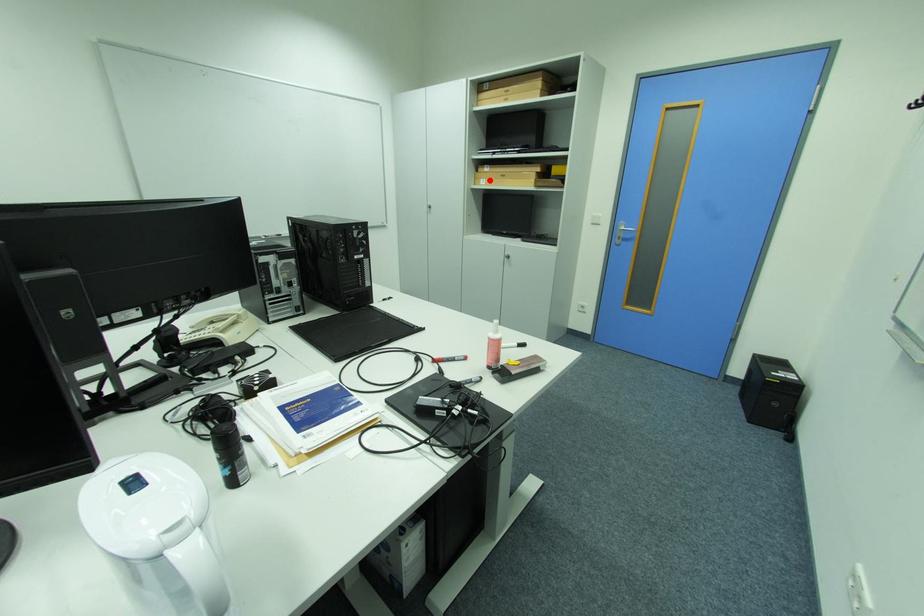
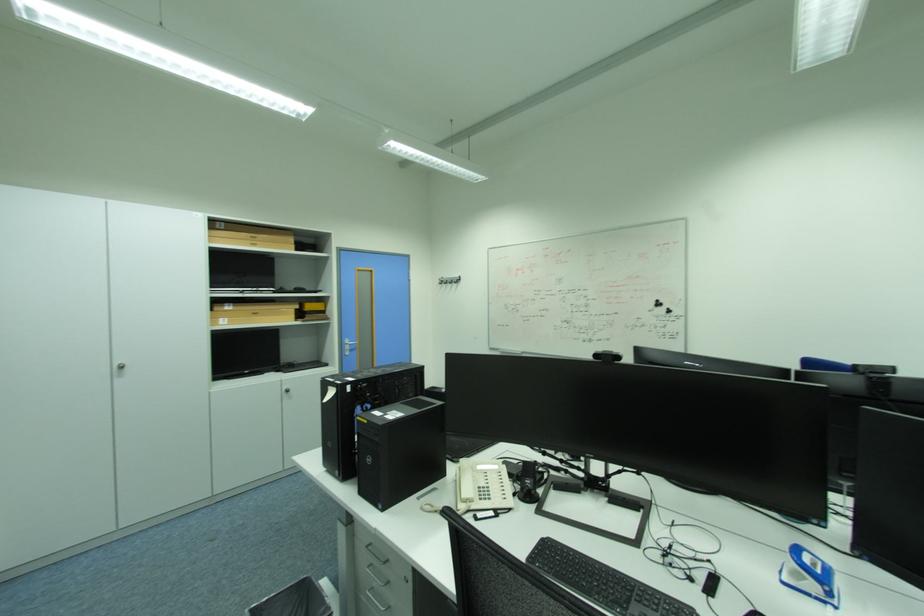
Question: I am providing you with two images of the same scene from different viewpoints. In image1, a red point is highlighted. Considering the same 3D point in image2, which of the following is correct?

Choices:
 (A) It is closer
 (B) It is farther

Answer: (B)